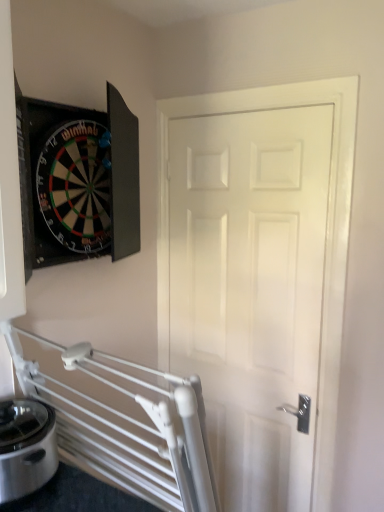
Question: Considering the positions of white glossy door at center and satin silver appliance at lower left in the image, is white glossy door at center wider or thinner than satin silver appliance at lower left?

Choices:
 (A) thin
 (B) wide

Answer: (A)

Question: Considering their positions, is white glossy door at center located in front of or behind satin silver appliance at lower left?

Choices:
 (A) front
 (B) behind

Answer: (B)

Question: From a real-world perspective, is white glossy door at center above or below satin silver appliance at lower left?

Choices:
 (A) below
 (B) above

Answer: (B)

Question: From a real-world perspective, is satin silver appliance at lower left positioned above or below white glossy door at center?

Choices:
 (A) above
 (B) below

Answer: (B)

Question: In terms of size, does satin silver appliance at lower left appear bigger or smaller than white glossy door at center?

Choices:
 (A) small
 (B) big

Answer: (A)

Question: Is point (39, 434) closer or farther from the camera than point (268, 453)?

Choices:
 (A) closer
 (B) farther

Answer: (A)

Question: Considering the positions of satin silver appliance at lower left and white glossy door at center in the image, is satin silver appliance at lower left wider or thinner than white glossy door at center?

Choices:
 (A) thin
 (B) wide

Answer: (B)